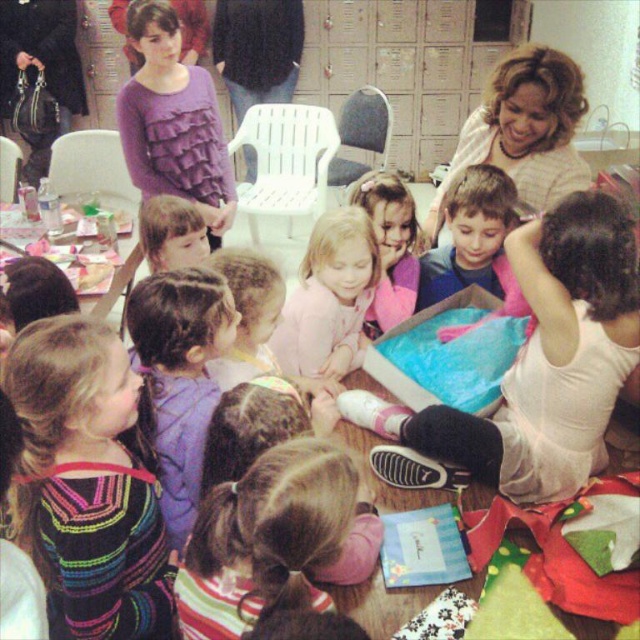
You are a photographer at the birthday party and need to capture a photo of the pink fabric at center and the light purple sweater at center. Which object should you focus on first if you want to ensure both are in the frame without moving the camera?

You should focus on the pink fabric at center first because it is taller than the light purple sweater at center, so it might be more prominent and easier to center in the frame.

You are a photographer at the birthday party. You need to capture a photo of the pink fabric at center and the pink fabric dress at center. Which one is positioned lower in the frame?

The pink fabric at center is located below the pink fabric dress at center, so it is positioned lower in the frame.